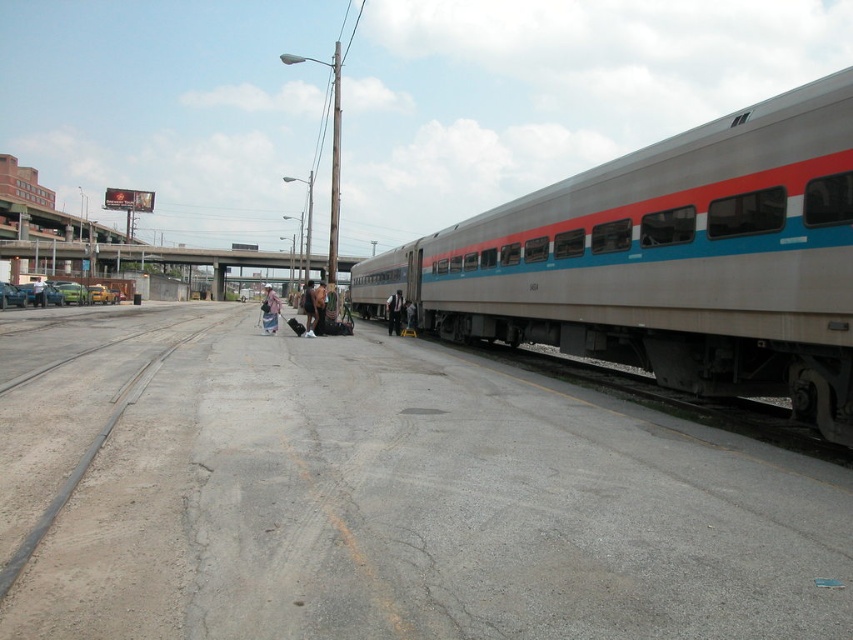
Who is positioned more to the right, silver metallic train at right or denim jacket at center?

From the viewer's perspective, silver metallic train at right appears more on the right side.

Which is below, silver metallic train at right or denim jacket at center?

Positioned lower is silver metallic train at right.

Is point (733, 218) closer to camera compared to point (271, 332)?

Yes, it is.

Where is `silver metallic train at right`? silver metallic train at right is located at coordinates (670, 260).

Is point (590, 259) farther from camera compared to point (397, 310)?

No, (590, 259) is in front of (397, 310).

Which is above, silver metallic train at right or light brown leather jacket at center?

silver metallic train at right is higher up.

Describe the element at coordinates (670, 260) in the screenshot. I see `silver metallic train at right` at that location.

Where is `silver metallic train at right`? The width and height of the screenshot is (853, 640). silver metallic train at right is located at coordinates [x=670, y=260].

Can you confirm if denim jacket at center is positioned to the left of light brown leather jacket at center?

Correct, you'll find denim jacket at center to the left of light brown leather jacket at center.

Image resolution: width=853 pixels, height=640 pixels. In order to click on denim jacket at center in this screenshot , I will do `click(270, 310)`.